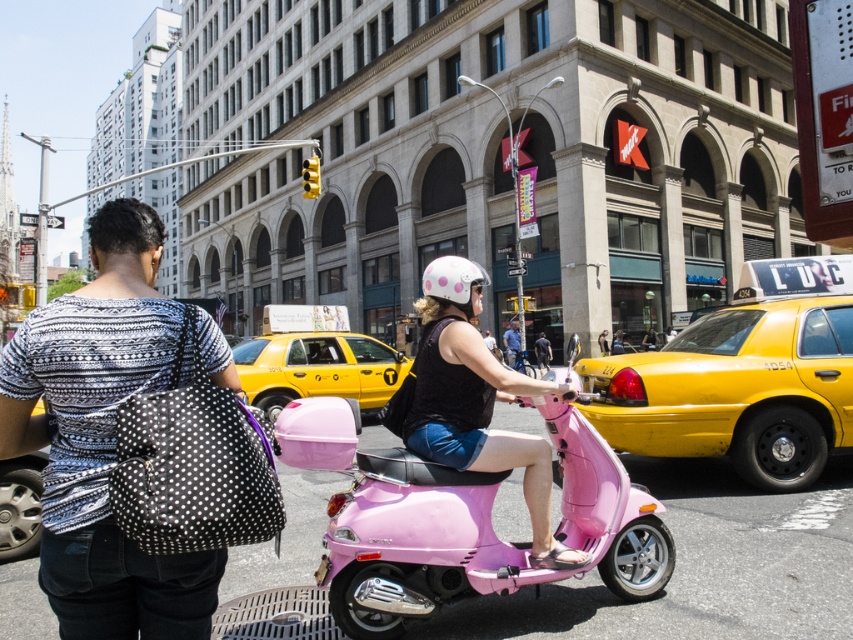
Which is behind, point (448, 468) or point (461, 289)?

Positioned behind is point (461, 289).

Which of these two, pink glossy scooter at center or white matte helmet at center, stands taller?

With more height is white matte helmet at center.

Between point (415, 465) and point (433, 276), which one is positioned behind?

The point (433, 276) is behind.

Identify the location of pink glossy scooter at center. The height and width of the screenshot is (640, 853). (415, 544).

Which of these two, pink glossy scooter at center or black smooth shirt at center, stands shorter?

→ Standing shorter between the two is black smooth shirt at center.

How much distance is there between pink glossy scooter at center and black smooth shirt at center?

pink glossy scooter at center is 26.70 meters away from black smooth shirt at center.

Between point (379, 496) and point (537, 340), which one is positioned behind?

Point (537, 340)

Image resolution: width=853 pixels, height=640 pixels. What are the coordinates of `pink glossy scooter at center` in the screenshot? It's located at (415, 544).

Between pink glossy scooter at center and matte black helmet at center, which one is positioned lower?

pink glossy scooter at center

Consider the image. Does pink glossy scooter at center appear on the left side of matte black helmet at center?

Indeed, pink glossy scooter at center is positioned on the left side of matte black helmet at center.

Identify the location of pink glossy scooter at center. (415, 544).